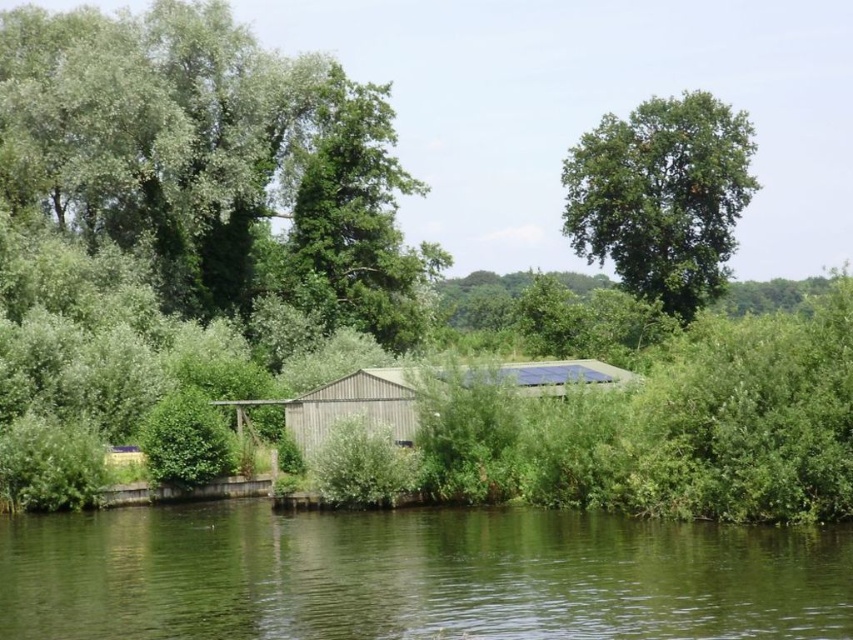
Based on the scene description, what is located at the coordinates point (415, 576)?

The green smooth water at center is located at point (415, 576).

From the picture: You are standing in the natural scene and want to take a photo of the green leafy tree at upper right without the green smooth water at center appearing in the foreground. Is this possible?

The green smooth water at center is closer to the viewer than the green leafy tree at upper right. To avoid the water in the foreground, you would need to position yourself so that the tree is framed behind the water or adjust your angle to exclude the water from the shot.